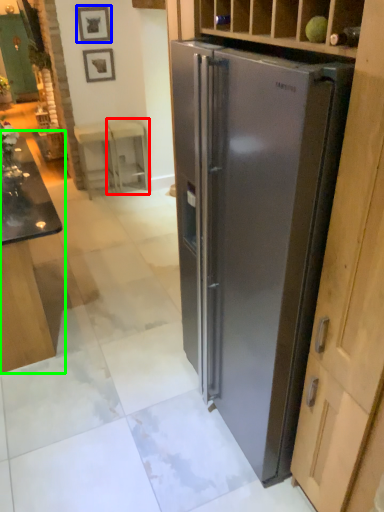
Question: Which is nearer to the stool (highlighted by a red box)? picture frame (highlighted by a blue box) or table (highlighted by a green box).

Choices:
 (A) picture frame
 (B) table

Answer: (A)